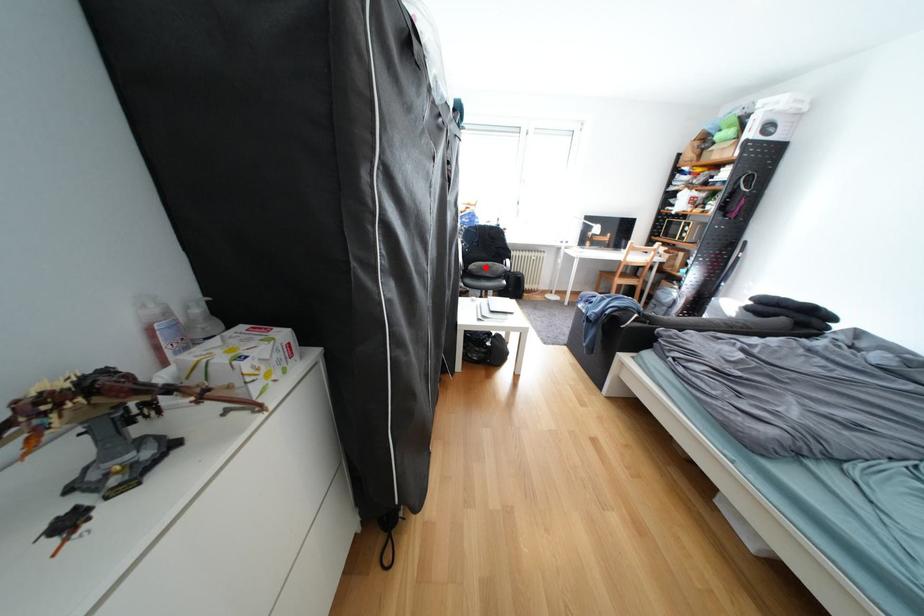
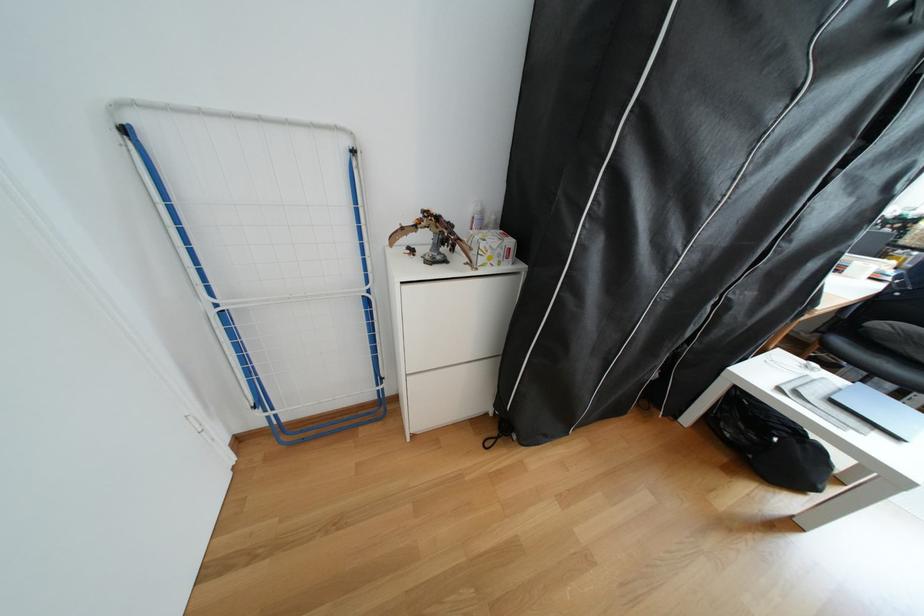
The point at the highlighted location is marked in the first image. Where is the corresponding point in the second image?

(894, 326)